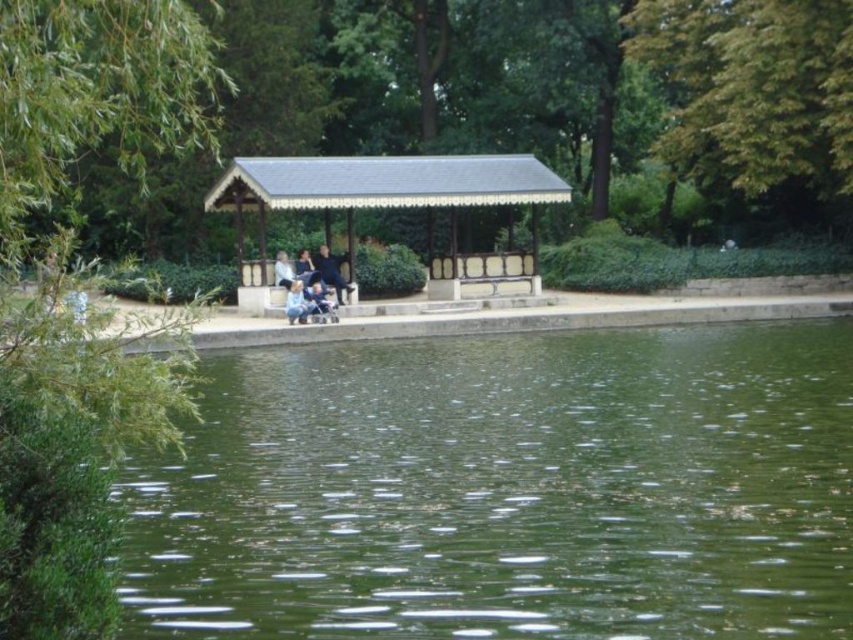
You are standing at the edge of the park near the pavilion and see the green liquid water at lower center and the green leafy tree at center. Which object is closer to the ground?

The green liquid water at lower center is located below green leafy tree at center, so it is closer to the ground.

You are a photographer planning to take a group photo of the light blue denim jeans at center and the green leafy tree at center. Which object should you focus on first if you want to ensure both are in focus, considering their sizes?

The green leafy tree at center is larger in size than the light blue denim jeans at center, so you should focus on the green leafy tree at center first to ensure both are in focus.

You are a photographer planning to take a photo of the green leafy tree at upper left and the light blue denim jeans at center in the park scene. Based on their sizes, which object will appear taller in the final photograph?

The green leafy tree at upper left will appear taller in the photograph because it has a greater height compared to the light blue denim jeans at center.